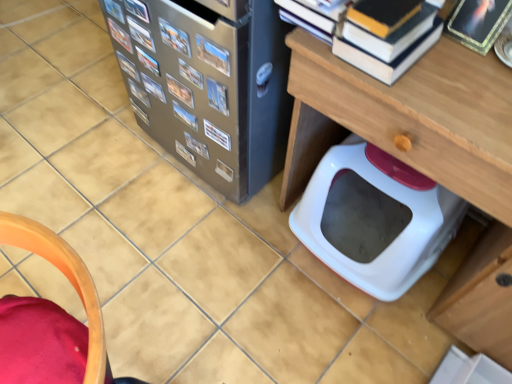
Question: Is metallic silver book at center, placed as the 13th book when sorted from front to back, in front of metallic silver book at center, the eleventh book when ordered from back to front?

Choices:
 (A) yes
 (B) no

Answer: (B)

Question: Is metallic silver book at center, placed as the 13th book when sorted from front to back, positioned far away from metallic silver book at center, which is the 5th book from front to back?

Choices:
 (A) no
 (B) yes

Answer: (A)

Question: From the image's perspective, does metallic silver book at center, placed as the 13th book when sorted from front to back, appear lower than metallic silver book at center, which is the 5th book from front to back?

Choices:
 (A) yes
 (B) no

Answer: (B)

Question: Would you say metallic silver book at center, which is the 5th book from front to back, is part of metallic silver book at center, placed as the 13th book when sorted from front to back,'s contents?

Choices:
 (A) yes
 (B) no

Answer: (B)

Question: From a real-world perspective, is metallic silver book at center, the third book in the back-to-front sequence, positioned under metallic silver book at center, the eleventh book when ordered from back to front, based on gravity?

Choices:
 (A) yes
 (B) no

Answer: (A)

Question: Is metallic silver book at center, the third book in the back-to-front sequence, turned away from metallic silver book at center, the eleventh book when ordered from back to front?

Choices:
 (A) no
 (B) yes

Answer: (A)

Question: Does metallic silver book at center, placed as the 13th book when sorted from front to back, lie behind metallic silver book at upper left, which is the fourth book from front to back?

Choices:
 (A) yes
 (B) no

Answer: (A)

Question: Can you confirm if metallic silver book at center, the third book in the back-to-front sequence, is wider than metallic silver book at upper left, placed as the twelfth book when sorted from back to front?

Choices:
 (A) no
 (B) yes

Answer: (A)

Question: Is metallic silver book at center, placed as the 13th book when sorted from front to back, next to metallic silver book at upper left, placed as the twelfth book when sorted from back to front?

Choices:
 (A) no
 (B) yes

Answer: (A)

Question: Could you tell me if metallic silver book at center, the third book in the back-to-front sequence, is turned towards metallic silver book at upper left, which is the fourth book from front to back?

Choices:
 (A) yes
 (B) no

Answer: (B)

Question: Is metallic silver book at center, placed as the 13th book when sorted from front to back, thinner than metallic silver book at upper left, which is the fourth book from front to back?

Choices:
 (A) yes
 (B) no

Answer: (A)

Question: From a real-world perspective, is metallic silver book at center, placed as the 13th book when sorted from front to back, under metallic silver book at upper left, which is the fourth book from front to back?

Choices:
 (A) no
 (B) yes

Answer: (B)

Question: From a real-world perspective, is metallic silver book at center-left, arranged as the 15th book when viewed from the front, over metallic photo album at upper center, which is the third book from front to back?

Choices:
 (A) yes
 (B) no

Answer: (B)